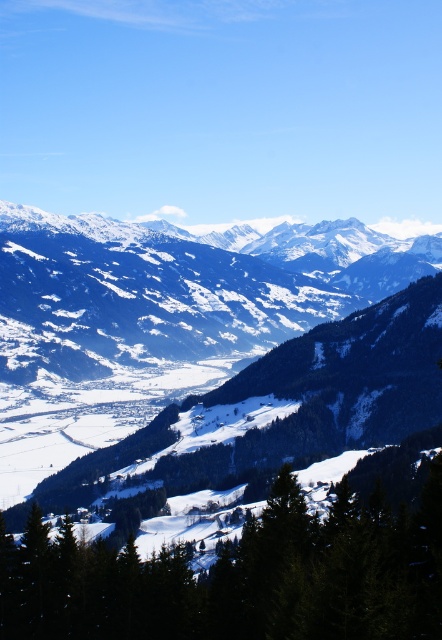
Consider the image. You are an outdoor photographer planning to capture the snowy rocky mountain range at center and the green textured tree at center in a single wide shot. Given that your camera can only accommodate one object as the primary focus, which object should you choose to ensure it fits entirely within the frame?

The snowy rocky mountain range at center has a greater width than the green textured tree at center, so you should choose the snowy rocky mountain range at center as the primary focus to ensure it fits entirely within the frame.

What does the point at coordinates (179, 289) represent in the winter landscape?

The point at coordinates (179, 289) marks the snowy rocky mountain range at center.